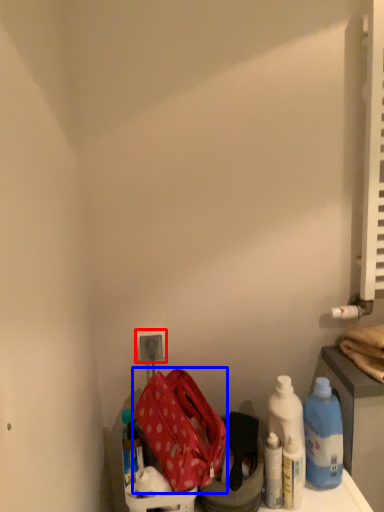
Question: Which of the following is the farthest to the observer, electric outlet (highlighted by a red box) or kit (highlighted by a blue box)?

Choices:
 (A) electric outlet
 (B) kit

Answer: (A)